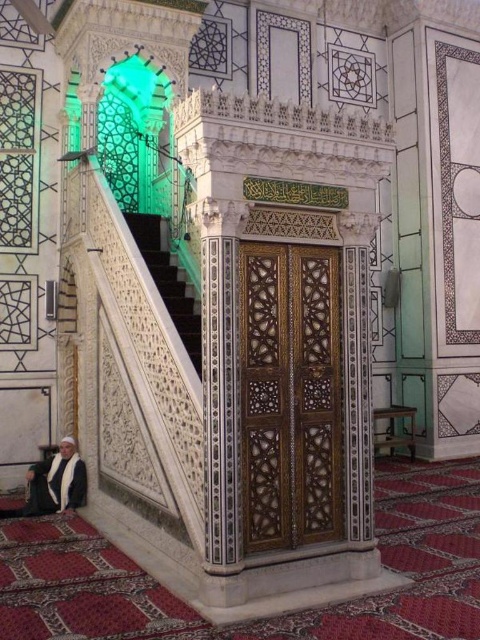
Can you confirm if white carved wood stairs at center is wider than white fabric person at lower left?

Correct, the width of white carved wood stairs at center exceeds that of white fabric person at lower left.

Who is taller, white carved wood stairs at center or white fabric person at lower left?

white carved wood stairs at center

Identify the location of white carved wood stairs at center. Image resolution: width=480 pixels, height=640 pixels. (167, 282).